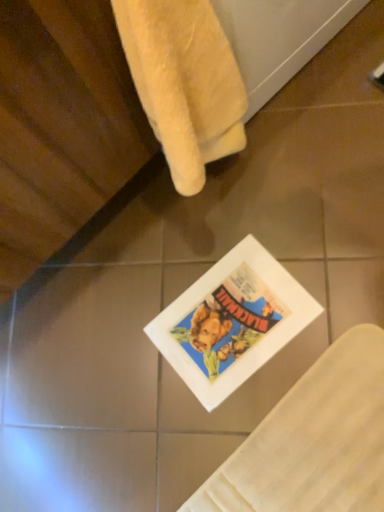
Describe the element at coordinates (232, 321) in the screenshot. This screenshot has height=512, width=384. I see `matte paper comic book at center` at that location.

At what (x,y) coordinates should I click in order to perform the action: click on matte paper comic book at center. Please return your answer as a coordinate pair (x, y). Looking at the image, I should click on (232, 321).

At what (x,y) coordinates should I click in order to perform the action: click on soft yellow towel at upper left. Please return your answer as a coordinate pair (x, y). This screenshot has height=512, width=384. Looking at the image, I should click on (184, 82).

Describe the element at coordinates (184, 82) in the screenshot. I see `soft yellow towel at upper left` at that location.

Measure the distance between point [151,18] and camera.

Point [151,18] is 45.80 centimeters away from camera.

The image size is (384, 512). I want to click on matte paper comic book at center, so click(x=232, y=321).

Considering the positions of objects matte paper comic book at center and soft yellow towel at upper left in the image provided, who is more to the right, matte paper comic book at center or soft yellow towel at upper left?

From the viewer's perspective, matte paper comic book at center appears more on the right side.

Which object is further away from the camera, matte paper comic book at center or soft yellow towel at upper left?

matte paper comic book at center is more distant.

Consider the image. Which is farther, (221,355) or (191,28)?

Point (221,355)

From the image's perspective, would you say matte paper comic book at center is positioned over soft yellow towel at upper left?

No, from the image's perspective, matte paper comic book at center is not on top of soft yellow towel at upper left.

From a real-world perspective, which is physically above, matte paper comic book at center or soft yellow towel at upper left?

soft yellow towel at upper left is physically above.

Which of these two, matte paper comic book at center or soft yellow towel at upper left, is thinner?

Thinner between the two is soft yellow towel at upper left.

Considering the sizes of matte paper comic book at center and soft yellow towel at upper left in the image, is matte paper comic book at center taller or shorter than soft yellow towel at upper left?

In the image, matte paper comic book at center appears to be shorter than soft yellow towel at upper left.

Considering the sizes of matte paper comic book at center and soft yellow towel at upper left in the image, is matte paper comic book at center bigger or smaller than soft yellow towel at upper left?

matte paper comic book at center is smaller than soft yellow towel at upper left.

Choose the correct answer: Is matte paper comic book at center inside soft yellow towel at upper left or outside it?

matte paper comic book at center exists outside the volume of soft yellow towel at upper left.

Are matte paper comic book at center and soft yellow towel at upper left making contact?

There is a gap between matte paper comic book at center and soft yellow towel at upper left.

Is matte paper comic book at center positioned with its back to soft yellow towel at upper left?

No, matte paper comic book at center is not facing away from soft yellow towel at upper left.

I want to click on towel above the matte paper comic book at center (from the image's perspective), so click(x=184, y=82).

Which object is positioned more to the right, soft yellow towel at upper left or matte paper comic book at center?

matte paper comic book at center is more to the right.

Is soft yellow towel at upper left behind matte paper comic book at center?

No, soft yellow towel at upper left is closer to the viewer.

Considering the points (214, 90) and (242, 275), which point is in front, point (214, 90) or point (242, 275)?

The point (214, 90) is closer to the camera.

From the image's perspective, which one is positioned higher, soft yellow towel at upper left or matte paper comic book at center?

soft yellow towel at upper left appears higher in the image.

From a real-world perspective, which is physically above, soft yellow towel at upper left or matte paper comic book at center?

soft yellow towel at upper left, from a real-world perspective.

Which object is thinner, soft yellow towel at upper left or matte paper comic book at center?

soft yellow towel at upper left.

In the scene shown: Considering the relative sizes of soft yellow towel at upper left and matte paper comic book at center in the image provided, is soft yellow towel at upper left shorter than matte paper comic book at center?

No.

Considering the sizes of soft yellow towel at upper left and matte paper comic book at center in the image, is soft yellow towel at upper left bigger or smaller than matte paper comic book at center?

Considering their sizes, soft yellow towel at upper left takes up more space than matte paper comic book at center.

Is soft yellow towel at upper left not inside matte paper comic book at center?

soft yellow towel at upper left lies outside matte paper comic book at center's area.

Are soft yellow towel at upper left and matte paper comic book at center making contact?

soft yellow towel at upper left is not next to matte paper comic book at center, and they're not touching.

Could you tell me if soft yellow towel at upper left is facing matte paper comic book at center?

No, soft yellow towel at upper left does not turn towards matte paper comic book at center.

How different are the orientations of soft yellow towel at upper left and matte paper comic book at center in degrees?

5.05 degrees separate the facing orientations of soft yellow towel at upper left and matte paper comic book at center.

Locate an element on the screen. The width and height of the screenshot is (384, 512). towel on the left of the matte paper comic book at center is located at coordinates (184, 82).

At what (x,y) coordinates should I click in order to perform the action: click on towel above the matte paper comic book at center (from a real-world perspective). Please return your answer as a coordinate pair (x, y). Looking at the image, I should click on (184, 82).

Image resolution: width=384 pixels, height=512 pixels. I want to click on towel in front of the matte paper comic book at center, so click(x=184, y=82).